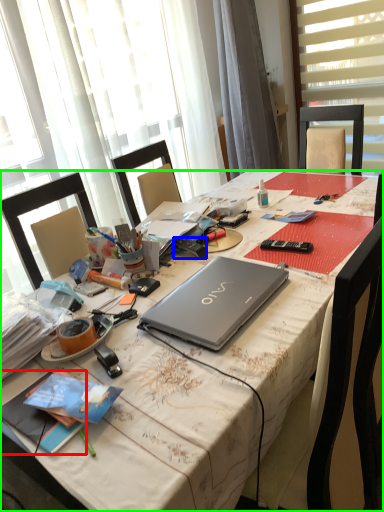
Question: Considering the real-world distances, which object is closest to book (highlighted by a red box)? remote control (highlighted by a blue box) or desk (highlighted by a green box).

Choices:
 (A) remote control
 (B) desk

Answer: (B)